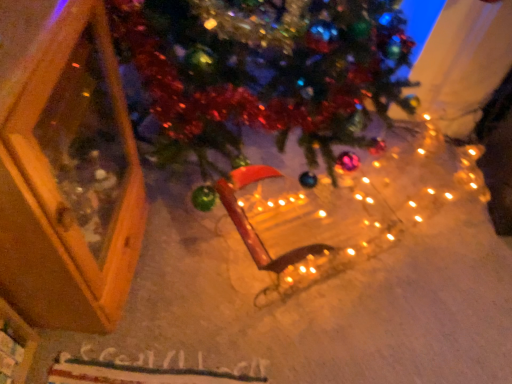
Describe the element at coordinates (66, 168) in the screenshot. Image resolution: width=512 pixels, height=384 pixels. I see `wooden frame at left` at that location.

The height and width of the screenshot is (384, 512). In order to click on wooden frame at left in this screenshot , I will do `click(66, 168)`.

In order to face wooden frame at left, should I rotate leftwards or rightwards?

Turn left by 29.228 degrees to look at wooden frame at left.

The image size is (512, 384). What do you see at coordinates (333, 216) in the screenshot?
I see `wooden sled at center` at bounding box center [333, 216].

Locate an element on the screen. wooden sled at center is located at coordinates (333, 216).

This screenshot has height=384, width=512. I want to click on wooden frame at left, so click(x=66, y=168).

Is wooden sled at center to the left or to the right of wooden frame at left in the image?

wooden sled at center is positioned on wooden frame at left's right side.

Which is in front, wooden sled at center or wooden frame at left?

wooden frame at left is closer to the camera.

Which is less distant, (263, 205) or (42, 192)?

The point (42, 192) is closer.

From the image's perspective, is wooden sled at center under wooden frame at left?

Indeed, from the image's perspective, wooden sled at center is shown beneath wooden frame at left.

From a real-world perspective, is wooden sled at center above or below wooden frame at left?

From a real-world perspective, wooden sled at center is physically below wooden frame at left.

From the picture: Considering the relative sizes of wooden sled at center and wooden frame at left in the image provided, is wooden sled at center thinner than wooden frame at left?

Correct, the width of wooden sled at center is less than that of wooden frame at left.

Does wooden sled at center have a greater height compared to wooden frame at left?

No.

Considering the relative sizes of wooden sled at center and wooden frame at left in the image provided, is wooden sled at center smaller than wooden frame at left?

Yes, wooden sled at center is smaller than wooden frame at left.

Is wooden sled at center not within wooden frame at left?

Yes.

Are wooden sled at center and wooden frame at left making contact?

No, wooden sled at center is not beside wooden frame at left.

Does wooden sled at center turn towards wooden frame at left?

No, wooden sled at center is not oriented towards wooden frame at left.

This screenshot has width=512, height=384. Identify the location of christmas light on the right of wooden frame at left. (333, 216).

Is wooden frame at left at the right side of wooden sled at center?

No.

Is the position of wooden frame at left less distant than that of wooden sled at center?

Yes, wooden frame at left is in front of wooden sled at center.

Which is nearer, (57, 284) or (295, 280)?

The point (57, 284) is more forward.

From the image's perspective, is wooden frame at left located above or below wooden sled at center?

Based on their image positions, wooden frame at left is located above wooden sled at center.

From a real-world perspective, between wooden frame at left and wooden sled at center, who is vertically lower?

wooden sled at center, from a real-world perspective.

Considering the relative sizes of wooden frame at left and wooden sled at center in the image provided, is wooden frame at left thinner than wooden sled at center?

No, wooden frame at left is not thinner than wooden sled at center.

Does wooden frame at left have a lesser height compared to wooden sled at center?

Incorrect, the height of wooden frame at left does not fall short of that of wooden sled at center.

Can you confirm if wooden frame at left is bigger than wooden sled at center?

Yes.

Do you think wooden frame at left is within wooden sled at center, or outside of it?

wooden frame at left cannot be found inside wooden sled at center.

Is wooden frame at left far away from wooden sled at center?

wooden frame at left is near wooden sled at center, not far away.

Is wooden frame at left looking in the opposite direction of wooden sled at center?

wooden frame at left does not have its back to wooden sled at center.

How different are the orientations of wooden frame at left and wooden sled at center in degrees?

wooden frame at left and wooden sled at center are facing 58.1 degrees away from each other.

Measure the distance from wooden frame at left to wooden sled at center.

wooden frame at left is 22.86 inches from wooden sled at center.

Where is `screen door in front of the wooden sled at center`? screen door in front of the wooden sled at center is located at coordinates (66, 168).

Where is `screen door in front of the wooden sled at center`? The height and width of the screenshot is (384, 512). screen door in front of the wooden sled at center is located at coordinates (66, 168).

The width and height of the screenshot is (512, 384). Identify the location of christmas light behind the wooden frame at left. (333, 216).